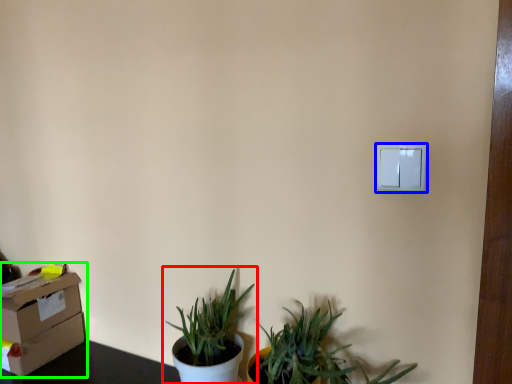
Question: Based on their relative distances, which object is farther from houseplant (highlighted by a red box)? Choose from light switch (highlighted by a blue box) and cardboard box (highlighted by a green box).

Choices:
 (A) light switch
 (B) cardboard box

Answer: (A)